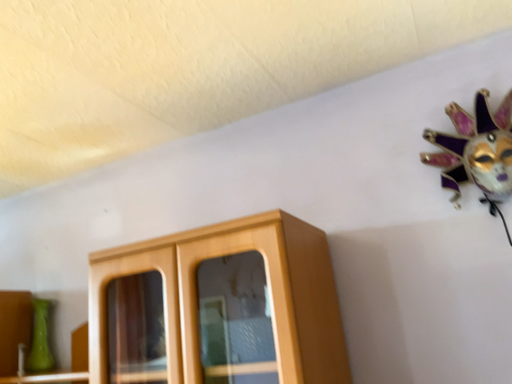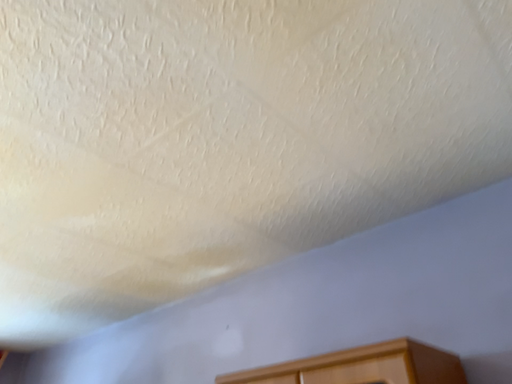
Question: Which way did the camera rotate in the video?

Choices:
 (A) rotated downward
 (B) rotated upward

Answer: (B)